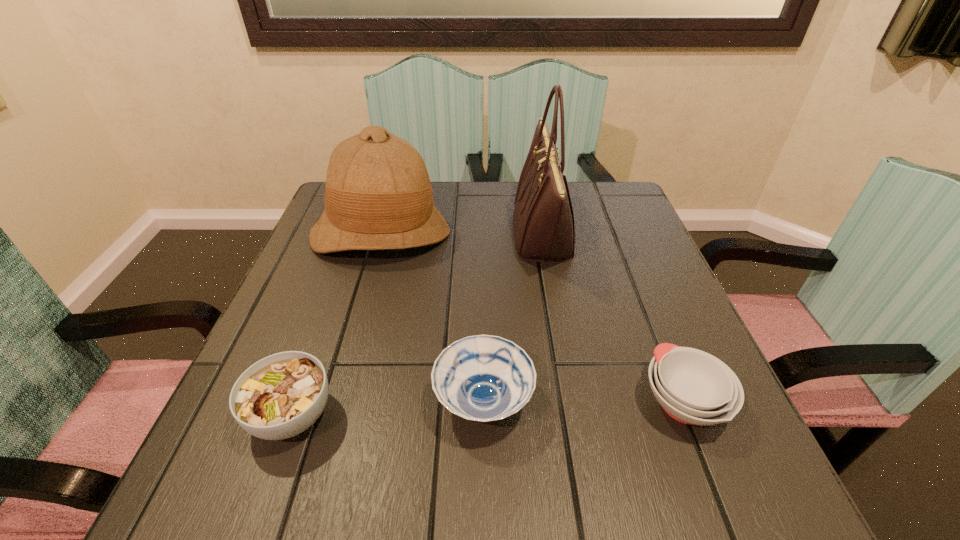
The height and width of the screenshot is (540, 960). I want to click on the tallest object, so click(543, 219).

Locate an element on the screen. the fourth shortest object is located at coordinates click(378, 195).

Where is `the leftmost soup bowl`? Image resolution: width=960 pixels, height=540 pixels. the leftmost soup bowl is located at coordinates point(278,397).

Where is `the second soup bowl from left to right`? The image size is (960, 540). the second soup bowl from left to right is located at coordinates (483, 378).

Image resolution: width=960 pixels, height=540 pixels. Identify the location of the rightmost soup bowl. (693, 387).

Find the location of a particular element. The width and height of the screenshot is (960, 540). vacant point located on the front-facing side of the handbag is located at coordinates (372, 234).

You are a GUI agent. You are given a task and a screenshot of the screen. Output one action in this format:
    pyautogui.click(x=<x>, y=<y>)
    Task: Click on the free space located on the front-facing side of the handbag
    The width and height of the screenshot is (960, 540).
    Given the screenshot: What is the action you would take?
    pyautogui.click(x=392, y=234)

The image size is (960, 540). I want to click on vacant space positioned 0.090m on the front-facing side of the handbag, so [476, 234].

Find the location of `vacant region located on the front-facing side of the second tallest object`. vacant region located on the front-facing side of the second tallest object is located at coordinates point(323,435).

I want to click on vacant space positioned 0.180m on the back of the leftmost soup bowl, so click(332, 305).